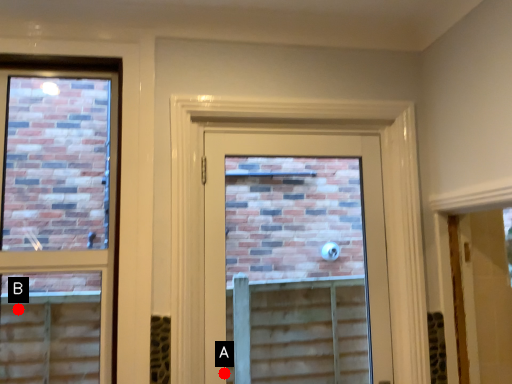
Question: Two points are circled on the image, labeled by A and B beside each circle. Which of the following is the farthest from the observer?

Choices:
 (A) A is further
 (B) B is further

Answer: (B)